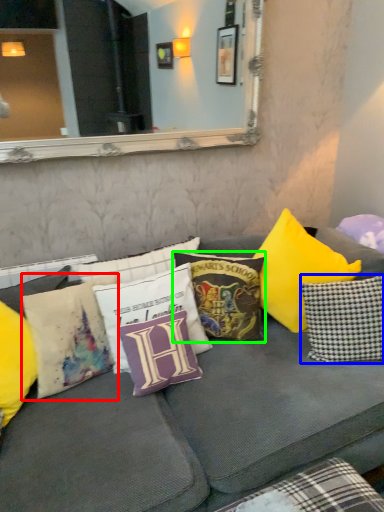
Question: Based on their relative distances, which object is farther from pillow (highlighted by a red box)? Choose from pillow (highlighted by a blue box) and pillow (highlighted by a green box).

Choices:
 (A) pillow
 (B) pillow

Answer: (A)